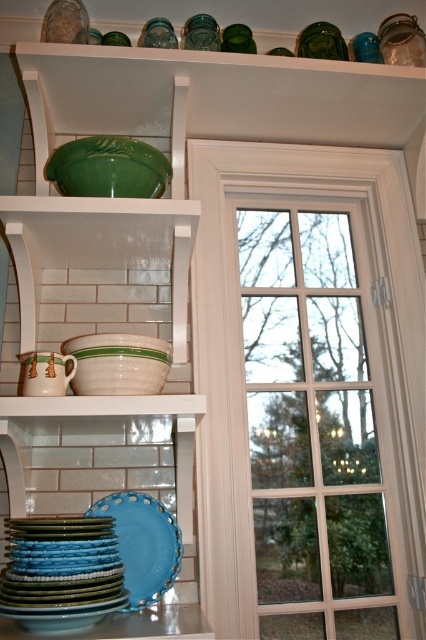
Which is behind, point (158, 500) or point (42, 353)?

The point (158, 500) is behind.

Between point (175, 524) and point (31, 358), which one is positioned in front?

Positioned in front is point (31, 358).

Image resolution: width=426 pixels, height=640 pixels. I want to click on blue matte platter at lower left, so [143, 545].

At what (x,y) coordinates should I click in order to perform the action: click on white wood window at center. Please return your answer as a coordinate pair (x, y). This screenshot has width=426, height=640. Looking at the image, I should click on (313, 424).

Can you confirm if white wood window at center is positioned to the right of matte white pitcher at lower left?

Yes, white wood window at center is to the right of matte white pitcher at lower left.

You are a GUI agent. You are given a task and a screenshot of the screen. Output one action in this format:
    pyautogui.click(x=<x>, y=<y>)
    Task: Click on the white wood window at center
    This screenshot has height=640, width=426.
    Given the screenshot: What is the action you would take?
    pyautogui.click(x=313, y=424)

You are a GUI agent. You are given a task and a screenshot of the screen. Output one action in this format:
    pyautogui.click(x=<x>, y=<y>)
    Task: Click on the white wood window at center
    The image size is (426, 640).
    Given the screenshot: What is the action you would take?
    pyautogui.click(x=313, y=424)

Between blue glossy platter at lower left and blue matte platter at lower left, which one is positioned lower?

blue matte platter at lower left is below.

Is blue glossy platter at lower left closer to the viewer compared to blue matte platter at lower left?

Yes.

Is point (66, 609) positioned in front of point (169, 513)?

Yes, point (66, 609) is in front of point (169, 513).

This screenshot has height=640, width=426. I want to click on blue glossy platter at lower left, so click(62, 572).